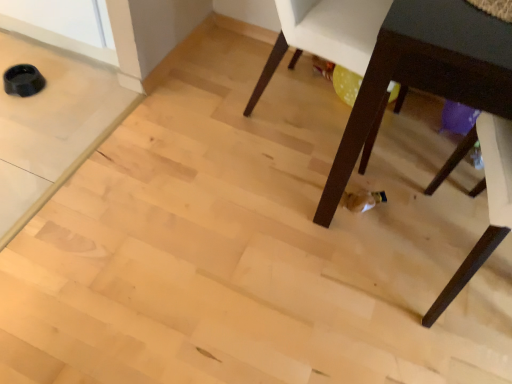
You are a GUI agent. You are given a task and a screenshot of the screen. Output one action in this format:
    pyautogui.click(x=<x>, y=<y>)
    Task: Click on the vacant space underneath dark wood chair at lower right, acting as the 1th chair starting from the bottom (from a real-world perspective)
    
    Given the screenshot: What is the action you would take?
    pyautogui.click(x=473, y=311)